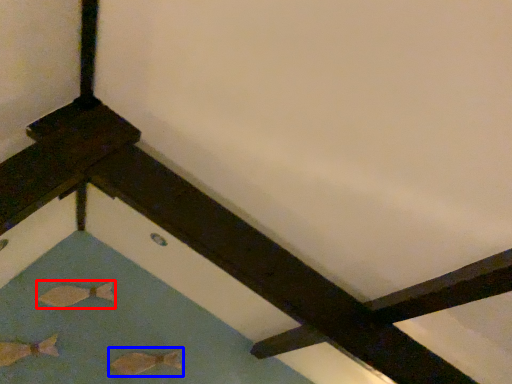
Question: Among these objects, which one is nearest to the camera, fish (highlighted by a red box) or fish (highlighted by a blue box)?

Choices:
 (A) fish
 (B) fish

Answer: (B)